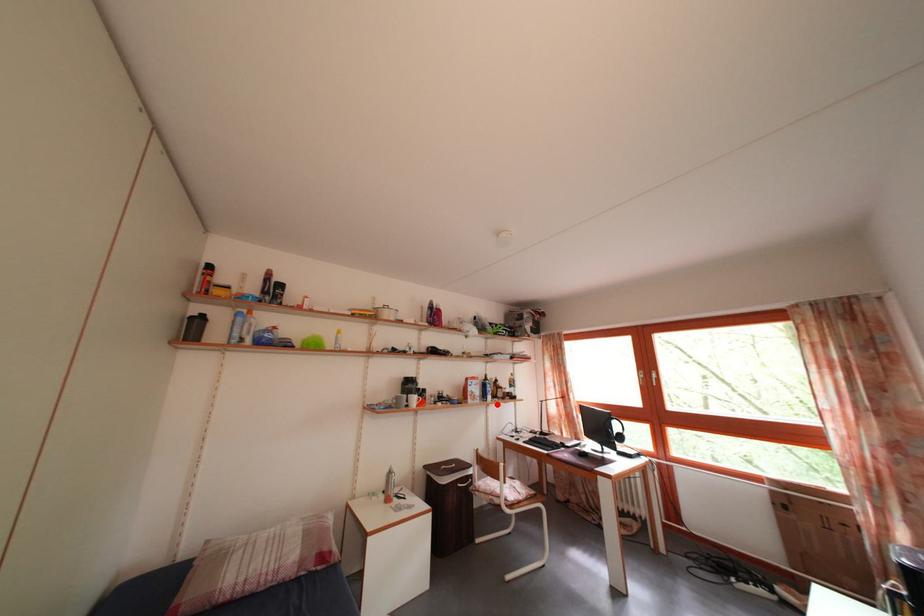
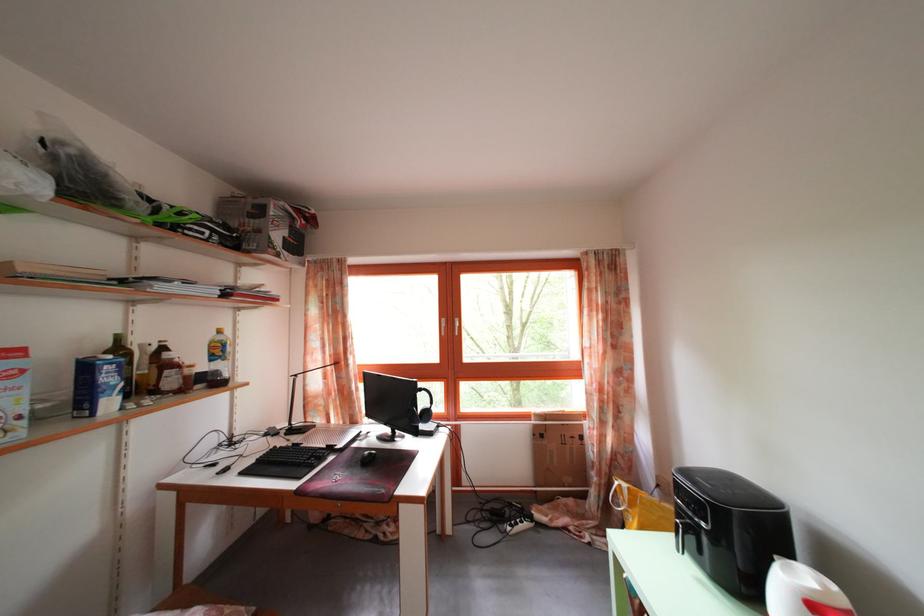
Question: A red point is marked in image1. In image2, is the corresponding 3D point closer to the camera or farther? Reply with the corresponding letter.

Choices:
 (A) The corresponding 3D point is closer.
 (B) The corresponding 3D point is farther.

Answer: (A)